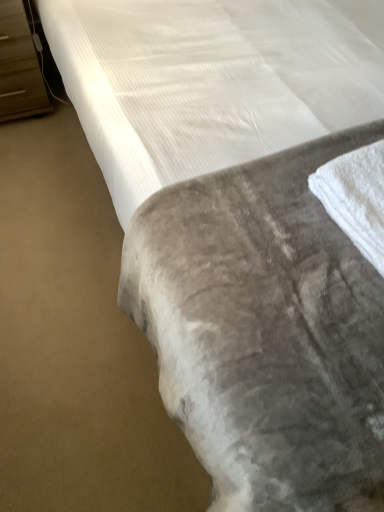
Question: In the image, is white soft towel at lower right positioned in front of or behind brown wood dresser at left?

Choices:
 (A) behind
 (B) front

Answer: (B)

Question: Is white soft towel at lower right taller or shorter than brown wood dresser at left?

Choices:
 (A) tall
 (B) short

Answer: (B)

Question: Looking at the image, does white soft towel at lower right seem bigger or smaller compared to brown wood dresser at left?

Choices:
 (A) small
 (B) big

Answer: (A)

Question: Would you say brown wood dresser at left is inside or outside white soft towel at lower right?

Choices:
 (A) inside
 (B) outside

Answer: (B)

Question: From the image's perspective, relative to white soft towel at lower right, is brown wood dresser at left above or below?

Choices:
 (A) above
 (B) below

Answer: (A)

Question: Is point (3, 73) positioned closer to the camera than point (375, 257)?

Choices:
 (A) closer
 (B) farther

Answer: (B)

Question: From a real-world perspective, relative to white soft towel at lower right, is brown wood dresser at left vertically above or below?

Choices:
 (A) below
 (B) above

Answer: (A)